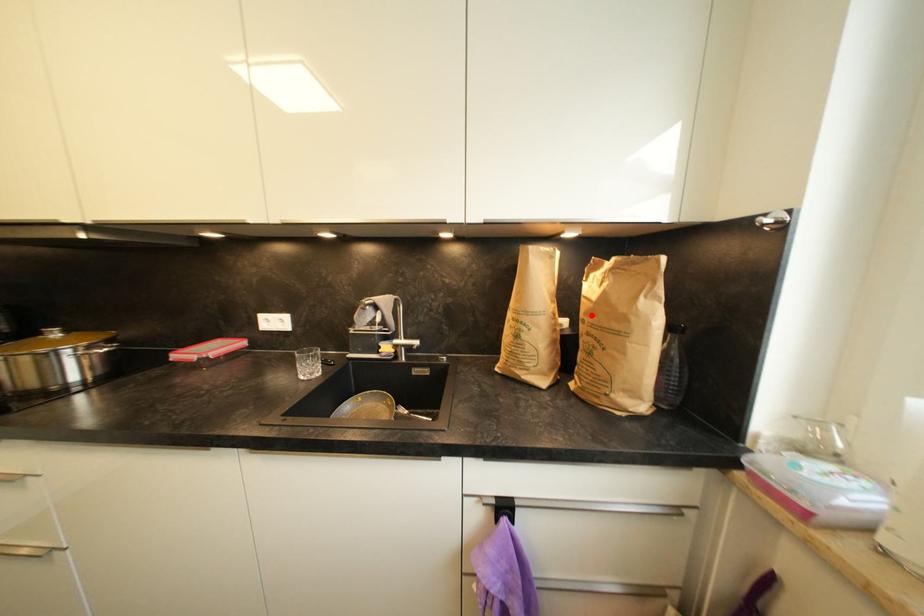
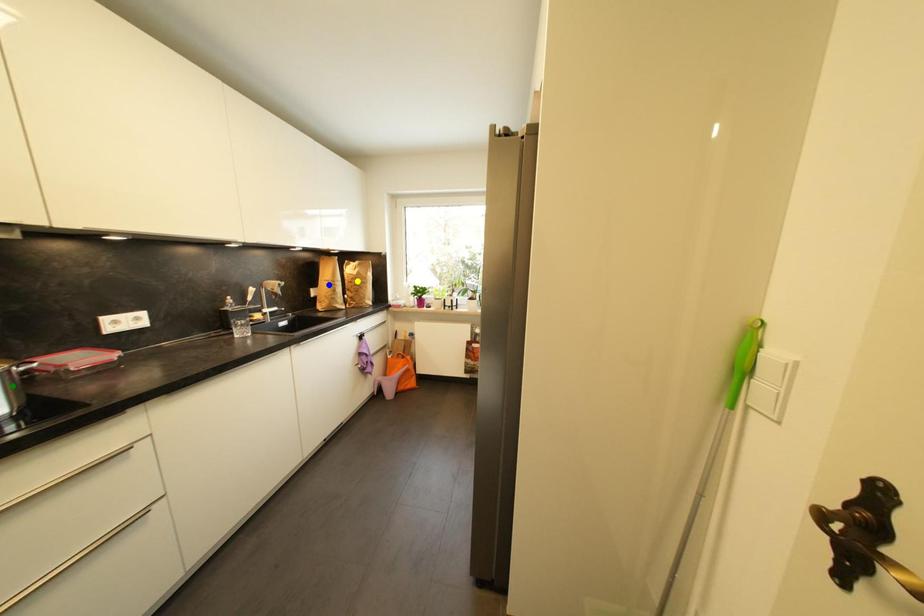
Question: I am providing you with two images of the same scene from different viewpoints. A red point is marked on the first image. You are given multiple points on the second image. Which point in image 2 is actually the same real-world point as the red point in image 1?

Choices:
 (A) green point
 (B) yellow point
 (C) blue point

Answer: (B)